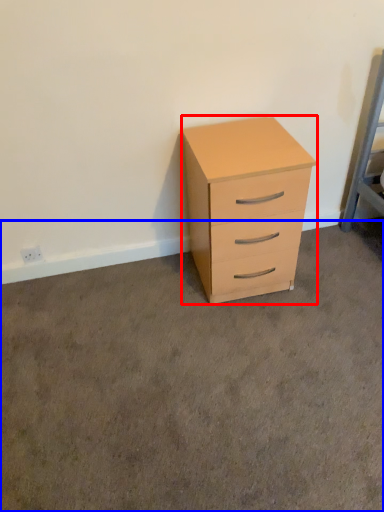
Question: Which object is closer to the camera taking this photo, chest of drawers (highlighted by a red box) or concrete (highlighted by a blue box)?

Choices:
 (A) chest of drawers
 (B) concrete

Answer: (B)